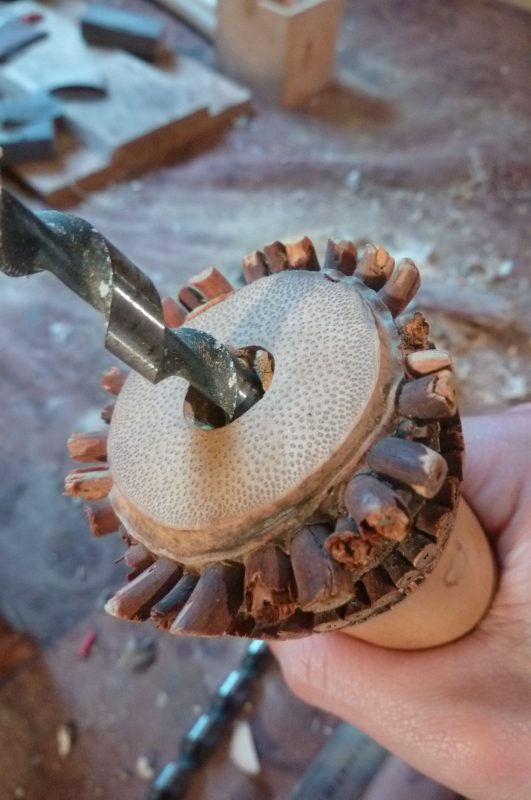
The height and width of the screenshot is (800, 531). In order to click on circular wood piece in this screenshot , I will do `click(335, 413)`.